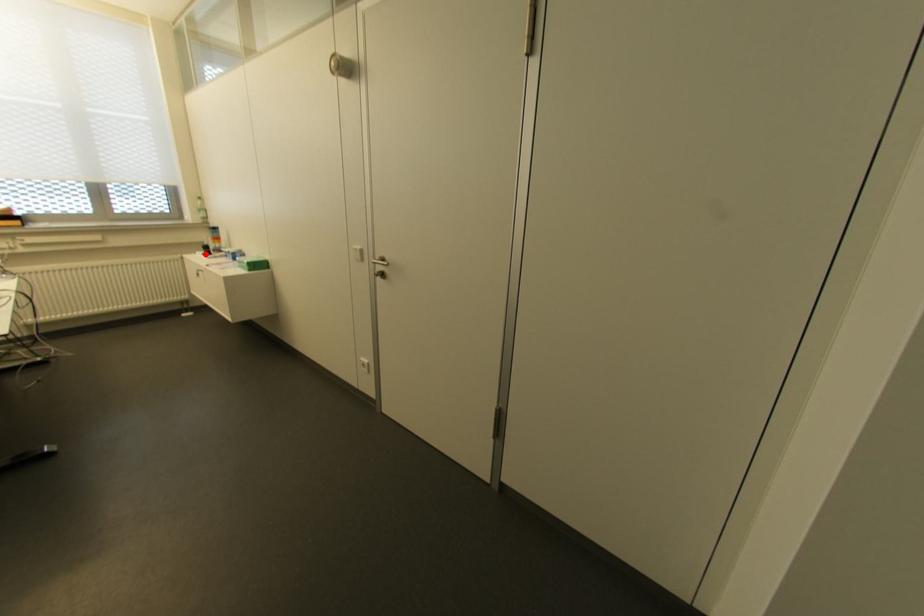
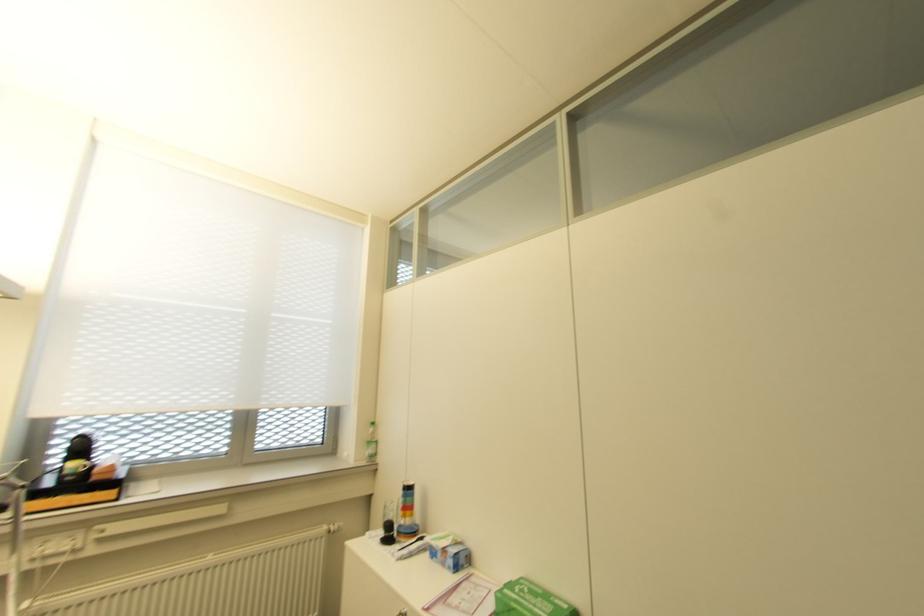
Question: A red point is marked in image1. In image2, is the corresponding 3D point closer to the camera or farther? Reply with the corresponding letter.

Choices:
 (A) The corresponding 3D point is closer.
 (B) The corresponding 3D point is farther.

Answer: (B)